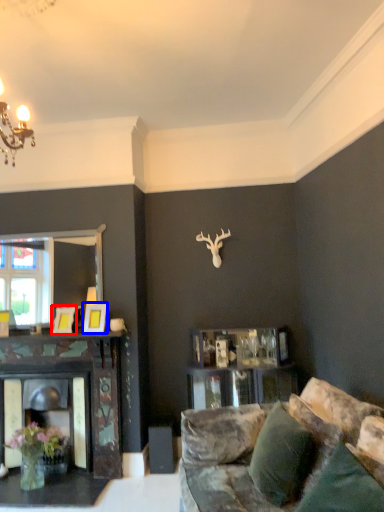
Question: Which object is further to the camera taking this photo, picture frame (highlighted by a red box) or picture frame (highlighted by a blue box)?

Choices:
 (A) picture frame
 (B) picture frame

Answer: (A)